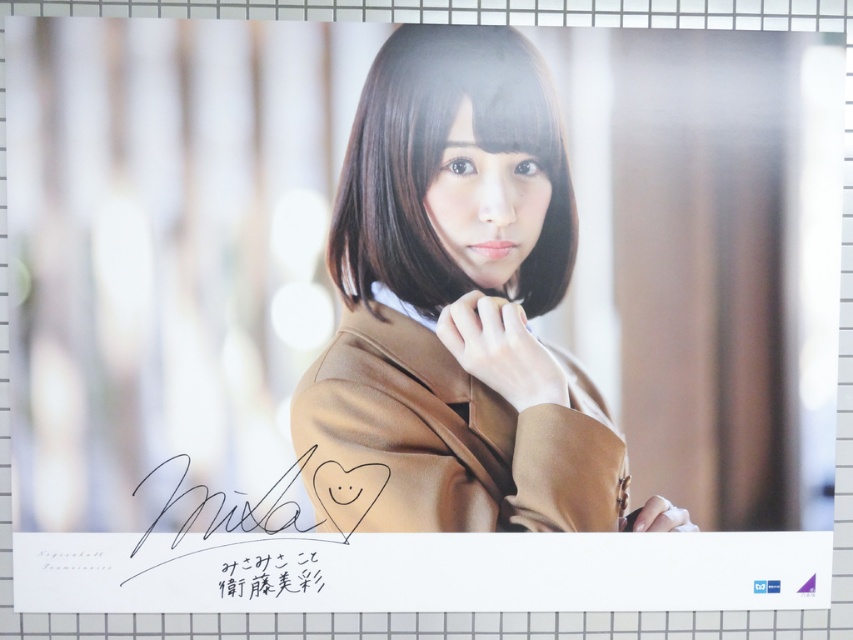
Measure the distance between matte brown trench coat at center and camera.

The distance of matte brown trench coat at center from camera is 1.80 meters.

Which of these two, matte brown trench coat at center or brown silky hair at center, stands taller?

brown silky hair at center

This screenshot has height=640, width=853. What are the coordinates of `matte brown trench coat at center` in the screenshot? It's located at (445, 440).

You are a GUI agent. You are given a task and a screenshot of the screen. Output one action in this format:
    pyautogui.click(x=<x>, y=<y>)
    Task: Click on the matte brown trench coat at center
    Image resolution: width=853 pixels, height=640 pixels.
    Given the screenshot: What is the action you would take?
    pyautogui.click(x=445, y=440)

Is brown silky hair at center further to the viewer compared to black ink signature at lower center?

No, it is in front of black ink signature at lower center.

This screenshot has width=853, height=640. In order to click on brown silky hair at center in this screenshot , I will do `click(438, 163)`.

Which is more to the left, matte brown coat at center or matte brown trench coat at center?

From the viewer's perspective, matte brown trench coat at center appears more on the left side.

Does matte brown coat at center appear on the left side of matte brown trench coat at center?

No, matte brown coat at center is not to the left of matte brown trench coat at center.

The height and width of the screenshot is (640, 853). I want to click on matte brown coat at center, so click(454, 307).